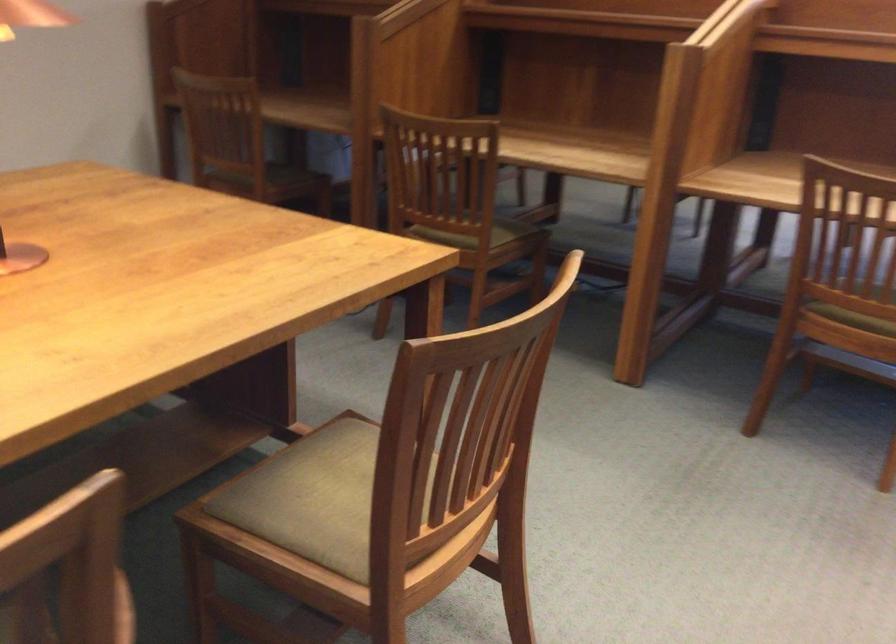
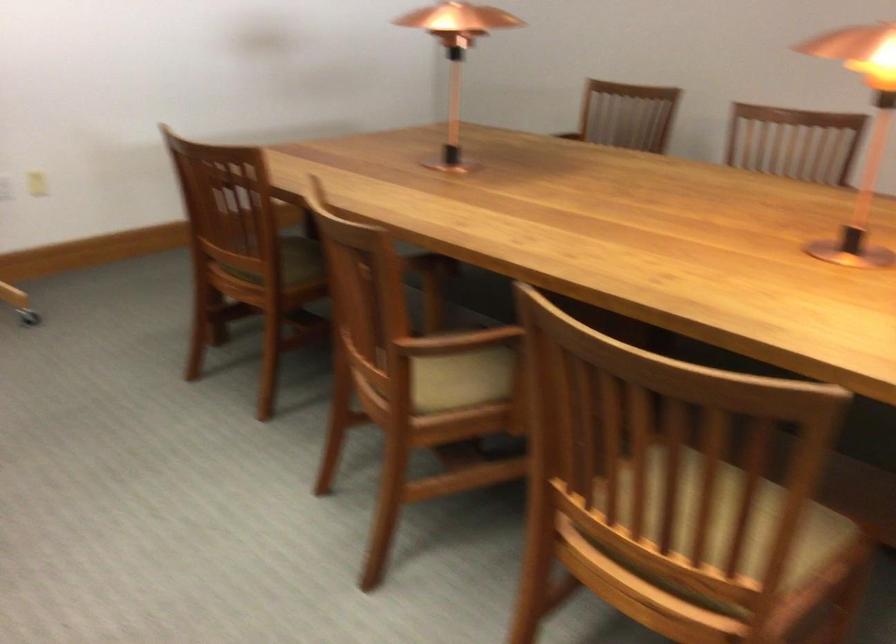
Question: I am providing you with two images of the same scene from different viewpoints. After the viewpoint changes to image2, which objects are now occluded?

Choices:
 (A) caster wheel
 (B) curved black handle
 (C) green chair sitting surface
 (D) beige chair sitting surface

Answer: (C)